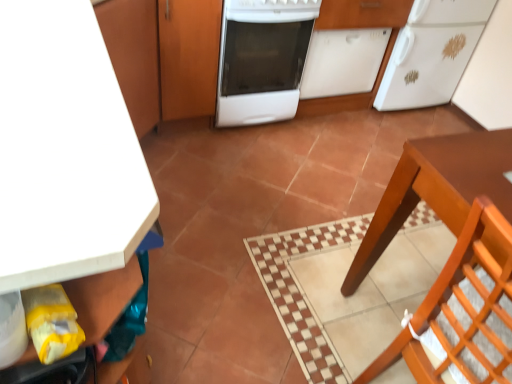
Locate an element on the screen. This screenshot has width=512, height=384. matte wood cabinet at upper left, the 4th cabinetry positioned from the right is located at coordinates (134, 56).

Locate an element on the screen. Image resolution: width=512 pixels, height=384 pixels. wooden cabinet at center, arranged as the third cabinetry when viewed from the left is located at coordinates (188, 56).

Find the location of a particular element. The image size is (512, 384). white matte refrigerator at upper right is located at coordinates (432, 53).

Where is `white glossy dishwasher at center`? white glossy dishwasher at center is located at coordinates (262, 59).

This screenshot has height=384, width=512. I want to click on matte wood cabinet at upper left, marked as the first cabinetry in a left-to-right arrangement, so click(x=134, y=56).

From the image's perspective, relative to white matte cabinet at upper left, which ranks as the third cabinetry in right-to-left order, is brown wooden table at lower right above or below?

From the image's perspective, brown wooden table at lower right appears below white matte cabinet at upper left, which ranks as the third cabinetry in right-to-left order.

Is brown wooden table at lower right directly adjacent to white matte cabinet at upper left, which ranks as the third cabinetry in right-to-left order?

No, brown wooden table at lower right is not touching white matte cabinet at upper left, which ranks as the third cabinetry in right-to-left order.

From their relative heights in the image, would you say brown wooden table at lower right is taller or shorter than white matte cabinet at upper left, which ranks as the third cabinetry in right-to-left order?

In the image, brown wooden table at lower right appears to be shorter than white matte cabinet at upper left, which ranks as the third cabinetry in right-to-left order.

Would you say wooden chair at lower right is inside or outside matte wood cabinet at upper left, marked as the first cabinetry in a left-to-right arrangement?

wooden chair at lower right is not enclosed by matte wood cabinet at upper left, marked as the first cabinetry in a left-to-right arrangement.

Is point (444, 332) in front of point (128, 81)?

Yes, point (444, 332) is closer to viewer.

In order to click on chair above the matte wood cabinet at upper left, marked as the first cabinetry in a left-to-right arrangement (from a real-world perspective) in this screenshot , I will do `click(462, 304)`.

Considering the sizes of wooden chair at lower right and matte wood cabinet at upper left, marked as the first cabinetry in a left-to-right arrangement, in the image, is wooden chair at lower right taller or shorter than matte wood cabinet at upper left, marked as the first cabinetry in a left-to-right arrangement,?

Considering their sizes, wooden chair at lower right has more height than matte wood cabinet at upper left, marked as the first cabinetry in a left-to-right arrangement.

How much distance is there between white glossy dishwasher at center and matte wood cabinet at upper left, the 4th cabinetry positioned from the right?

white glossy dishwasher at center is 20.21 inches away from matte wood cabinet at upper left, the 4th cabinetry positioned from the right.

From a real-world perspective, is white glossy dishwasher at center located beneath matte wood cabinet at upper left, the 4th cabinetry positioned from the right?

Yes.

From a real-world perspective, which cabinetry is the 2nd one above the white glossy dishwasher at center? Please provide its 2D coordinates.

[(134, 56)]

Are white glossy dishwasher at center and matte wood cabinet at upper left, the 4th cabinetry positioned from the right, far apart?

That's not correct — white glossy dishwasher at center is a little close to matte wood cabinet at upper left, the 4th cabinetry positioned from the right.

Does point (244, 28) come in front of point (131, 211)?

No, (244, 28) is further to viewer.

From a real-world perspective, which object stands above the other?

white matte cabinet at upper left, which ranks as the third cabinetry in right-to-left order, is physically above.

Which of these two, white glossy dishwasher at center or white matte cabinet at upper left, which ranks as the third cabinetry in right-to-left order, stands shorter?

With less height is white glossy dishwasher at center.

Who is bigger, white glossy dishwasher at center or white matte cabinet at upper left, which ranks as the third cabinetry in right-to-left order?

Bigger between the two is white matte cabinet at upper left, which ranks as the third cabinetry in right-to-left order.

Between matte wood cabinet at upper left, marked as the first cabinetry in a left-to-right arrangement, and wooden chair at lower right, which one has larger size?

Bigger between the two is matte wood cabinet at upper left, marked as the first cabinetry in a left-to-right arrangement.

In the scene shown: Is wooden chair at lower right at the back of matte wood cabinet at upper left, the 4th cabinetry positioned from the right?

No, matte wood cabinet at upper left, the 4th cabinetry positioned from the right,'s orientation is not away from wooden chair at lower right.

From the image's perspective, is matte wood cabinet at upper left, the 4th cabinetry positioned from the right, above wooden chair at lower right?

Correct, matte wood cabinet at upper left, the 4th cabinetry positioned from the right, appears higher than wooden chair at lower right in the image.

Which is closer to the camera, [209,53] or [408,59]?

Point [209,53] appears to be closer to the viewer than point [408,59].

From the image's perspective, is wooden cabinet at center, arranged as the second cabinetry when viewed from the right, above or below white matte refrigerator at upper right?

Based on their image positions, wooden cabinet at center, arranged as the second cabinetry when viewed from the right, is located beneath white matte refrigerator at upper right.

Is wooden cabinet at center, arranged as the second cabinetry when viewed from the right, wider or thinner than white matte refrigerator at upper right?

In the image, wooden cabinet at center, arranged as the second cabinetry when viewed from the right, appears to be wider than white matte refrigerator at upper right.

Locate an element on the screen. table on the right of wooden cabinet at center, arranged as the second cabinetry when viewed from the right is located at coordinates (437, 189).

In terms of width, does brown wooden table at lower right look wider or thinner when compared to wooden cabinet at center, arranged as the third cabinetry when viewed from the left?

brown wooden table at lower right is wider than wooden cabinet at center, arranged as the third cabinetry when viewed from the left.

Is brown wooden table at lower right closer to the viewer compared to wooden cabinet at center, arranged as the third cabinetry when viewed from the left?

Yes, brown wooden table at lower right is closer to the viewer.

Can you confirm if brown wooden table at lower right is taller than wooden cabinet at center, arranged as the second cabinetry when viewed from the right?

Correct, brown wooden table at lower right is much taller as wooden cabinet at center, arranged as the second cabinetry when viewed from the right.

At what (x,y) coordinates should I click in order to perform the action: click on table lying on the right of white matte cabinet at upper left, which is counted as the second cabinetry, starting from the left. Please return your answer as a coordinate pair (x, y). Image resolution: width=512 pixels, height=384 pixels. Looking at the image, I should click on (437, 189).

This screenshot has width=512, height=384. I want to click on chair in front of the matte wood cabinet at upper left, the 4th cabinetry positioned from the right, so click(462, 304).

From the image, which object appears to be nearer to wooden cabinet at center, arranged as the second cabinetry when viewed from the right, white matte refrigerator at upper right or matte wood cabinet at upper left, the 4th cabinetry positioned from the right?

matte wood cabinet at upper left, the 4th cabinetry positioned from the right, is positioned closer to the anchor wooden cabinet at center, arranged as the second cabinetry when viewed from the right.

Considering their positions, is white matte cabinet at upper left, which is counted as the second cabinetry, starting from the left, positioned closer to matte wood cabinet at upper left, marked as the first cabinetry in a left-to-right arrangement, than white glossy dishwasher at center?

white glossy dishwasher at center is closer to matte wood cabinet at upper left, marked as the first cabinetry in a left-to-right arrangement.

Considering their positions, is matte wood cabinet at upper left, the 4th cabinetry positioned from the right, positioned further to wooden chair at lower right than white matte cabinet at upper left, which ranks as the third cabinetry in right-to-left order?

matte wood cabinet at upper left, the 4th cabinetry positioned from the right, lies further to wooden chair at lower right than the other object.

Based on their spatial positions, is white matte refrigerator at upper right or white matte dishwasher at center, the 4th cabinetry from the left, further from white glossy dishwasher at center?

white matte refrigerator at upper right is positioned further to the anchor white glossy dishwasher at center.

Considering their positions, is wooden chair at lower right positioned closer to wooden cabinet at center, arranged as the third cabinetry when viewed from the left, than matte wood cabinet at upper left, marked as the first cabinetry in a left-to-right arrangement?

matte wood cabinet at upper left, marked as the first cabinetry in a left-to-right arrangement, is positioned closer to the anchor wooden cabinet at center, arranged as the third cabinetry when viewed from the left.

When comparing their distances from wooden chair at lower right, does white matte cabinet at upper left, which ranks as the third cabinetry in right-to-left order, or white matte dishwasher at center, the 4th cabinetry from the left, seem closer?

white matte cabinet at upper left, which ranks as the third cabinetry in right-to-left order, is positioned closer to the anchor wooden chair at lower right.

Considering their positions, is white matte refrigerator at upper right positioned further to matte wood cabinet at upper left, the 4th cabinetry positioned from the right, than white matte cabinet at upper left, which is counted as the second cabinetry, starting from the left?

white matte refrigerator at upper right is further to matte wood cabinet at upper left, the 4th cabinetry positioned from the right.

Based on their spatial positions, is white matte cabinet at upper left, which ranks as the third cabinetry in right-to-left order, or white matte refrigerator at upper right closer to white matte dishwasher at center, the 4th cabinetry from the left?

Among the two, white matte refrigerator at upper right is located nearer to white matte dishwasher at center, the 4th cabinetry from the left.

Find the location of a particular element. Image resolution: width=512 pixels, height=384 pixels. home appliance positioned between wooden chair at lower right and white matte refrigerator at upper right from near to far is located at coordinates (262, 59).

You are a GUI agent. You are given a task and a screenshot of the screen. Output one action in this format:
    pyautogui.click(x=<x>, y=<y>)
    Task: Click on the table between wooden chair at lower right and white matte dishwasher at center, the 4th cabinetry from the left, in the front-back direction
    
    Given the screenshot: What is the action you would take?
    pyautogui.click(x=437, y=189)

Where is `table between wooden chair at lower right and white matte refrigerator at upper right in the front-back direction`? Image resolution: width=512 pixels, height=384 pixels. table between wooden chair at lower right and white matte refrigerator at upper right in the front-back direction is located at coordinates (437, 189).

Locate an element on the screen. The height and width of the screenshot is (384, 512). home appliance situated between wooden cabinet at center, arranged as the third cabinetry when viewed from the left, and white matte dishwasher at center, the 4th cabinetry from the left, from left to right is located at coordinates (262, 59).